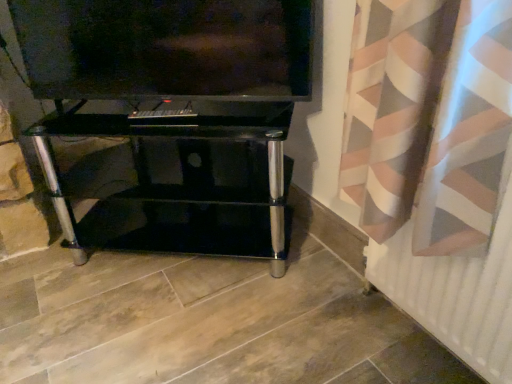
Question: Is point (212, 253) closer or farther from the camera than point (398, 269)?

Choices:
 (A) farther
 (B) closer

Answer: (A)

Question: From the image's perspective, is black glass tv stand at center positioned above or below white matte radiator at lower right?

Choices:
 (A) above
 (B) below

Answer: (A)

Question: Based on their relative distances, which object is nearer to the matte black tv at upper center?

Choices:
 (A) black glass tv stand at center
 (B) white matte radiator at lower right

Answer: (A)

Question: Estimate the real-world distances between objects in this image. Which object is closer to the black glass tv stand at center?

Choices:
 (A) white matte radiator at lower right
 (B) matte black tv at upper center

Answer: (B)